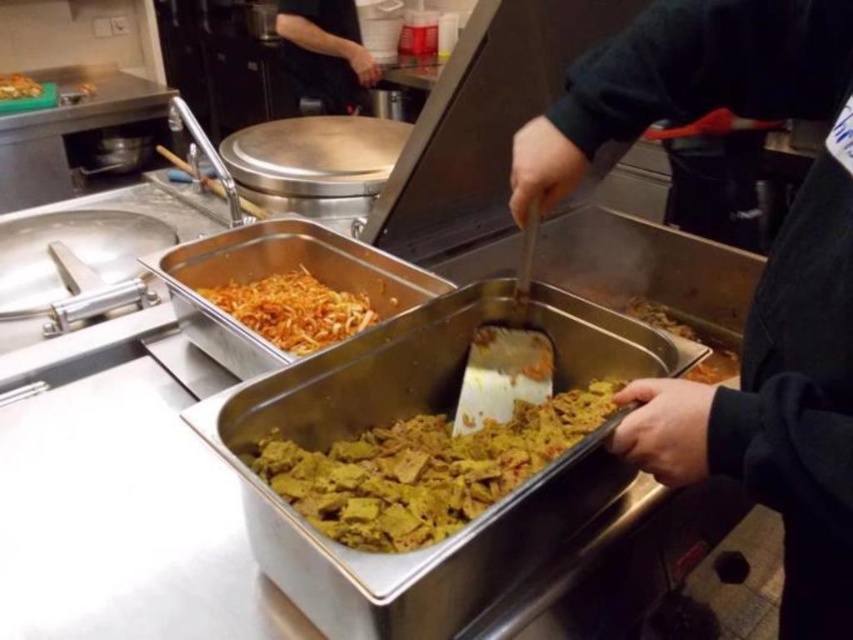
You are a customer at the buffet and want to point out the black fabric at upper center to the staff. Based on its coordinates, which container is it closer to, the left or the right?

The black fabric at upper center is located at point [325,51]. Since the containers are placed side by side on the counter, the x coordinate determines the horizontal position. The x coordinate of 0.081 is closer to 0, which is the left side of the image. Therefore, the black fabric at upper center is closer to the left container.

You are a customer at the buffet and want to point out the black fabric at upper center and the shiny orange shredded vegetables at upper left. Which one is bigger in size?

The black fabric at upper center is larger in size than the shiny orange shredded vegetables at upper left.